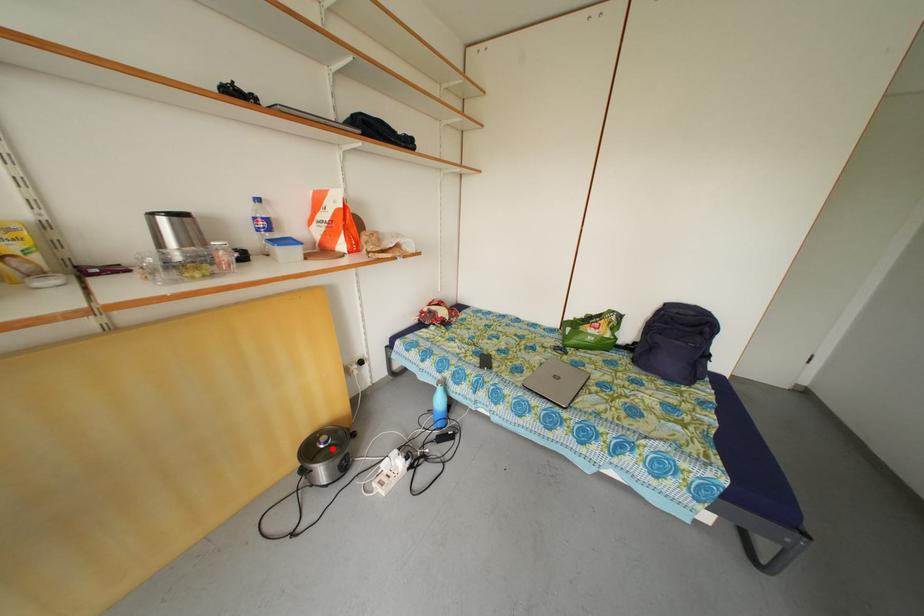
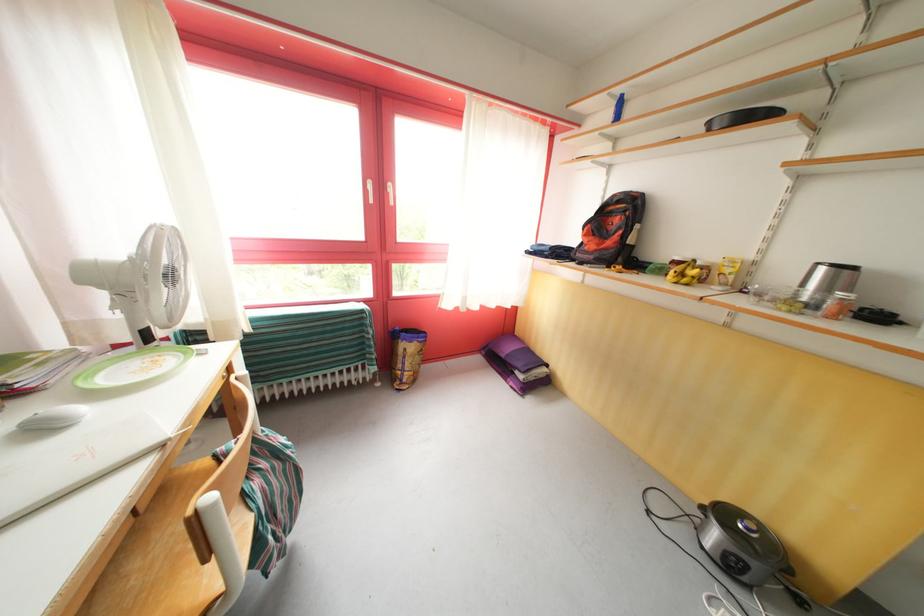
Question: I am providing you with two images of the same scene from different viewpoints. A red point is shown in image1. For the corresponding object point in image2, is it positioned nearer or farther from the camera?

Choices:
 (A) Nearer
 (B) Farther

Answer: (A)